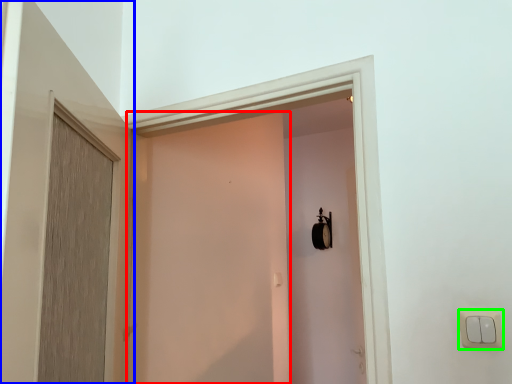
Question: Considering the real-world distances, which object is farthest from screen door (highlighted by a red box)? door (highlighted by a blue box) or light switch (highlighted by a green box)?

Choices:
 (A) door
 (B) light switch

Answer: (B)